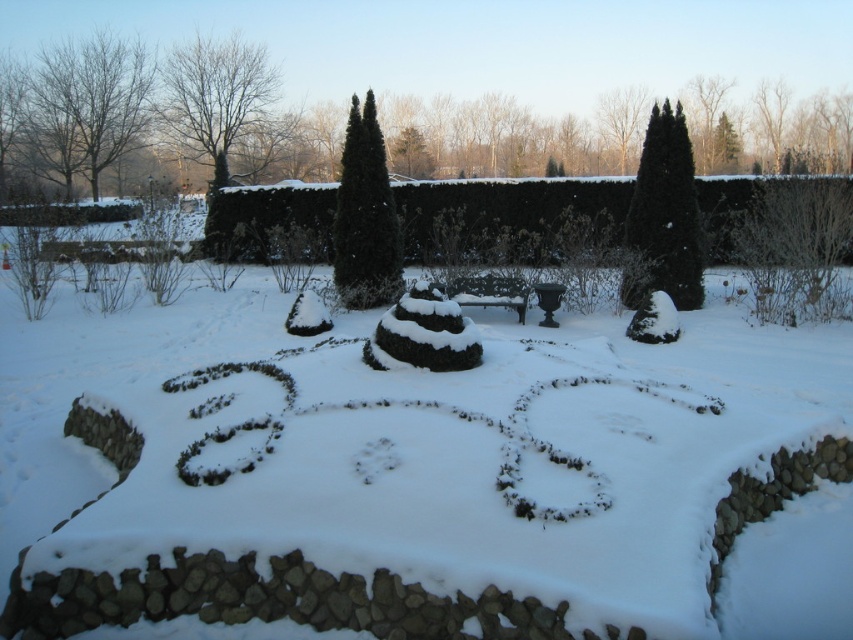
You are designing a winter garden layout and need to place a small decorative snowman between the green leafy hedge at center and the black textured hedge at upper right. Given their widths, which hedge should the snowman be closer to?

The green leafy hedge at center has a larger width than the black textured hedge at upper right, so the snowman should be placed closer to the black textured hedge at upper right to maintain balance in the garden layout.